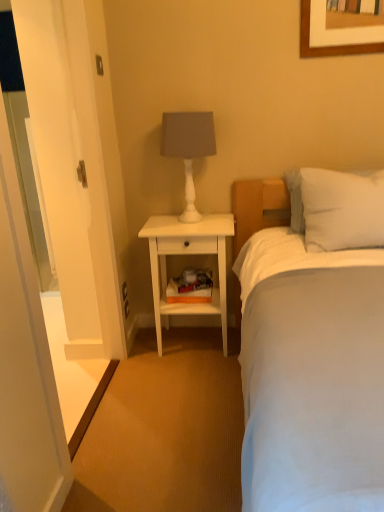
Locate an element on the screen. free spot below white wood nightstand at center (from a real-world perspective) is located at coordinates (190, 343).